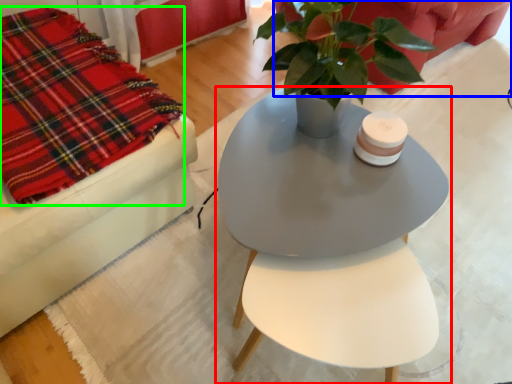
Question: Which is nearer to the table (highlighted by a red box)? couch (highlighted by a blue box) or cloth (highlighted by a green box).

Choices:
 (A) couch
 (B) cloth

Answer: (A)